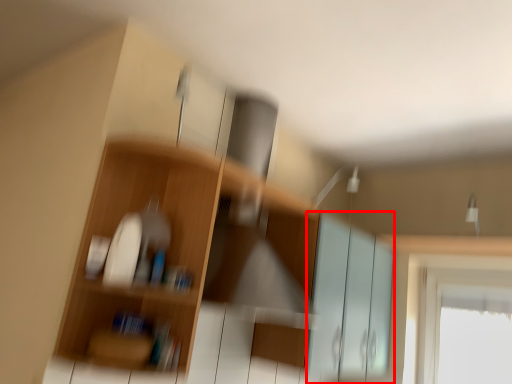
Question: Considering the relative positions of screen door (annotated by the red box) and shelf in the image provided, where is screen door (annotated by the red box) located with respect to the staircase?

Choices:
 (A) left
 (B) right

Answer: (B)